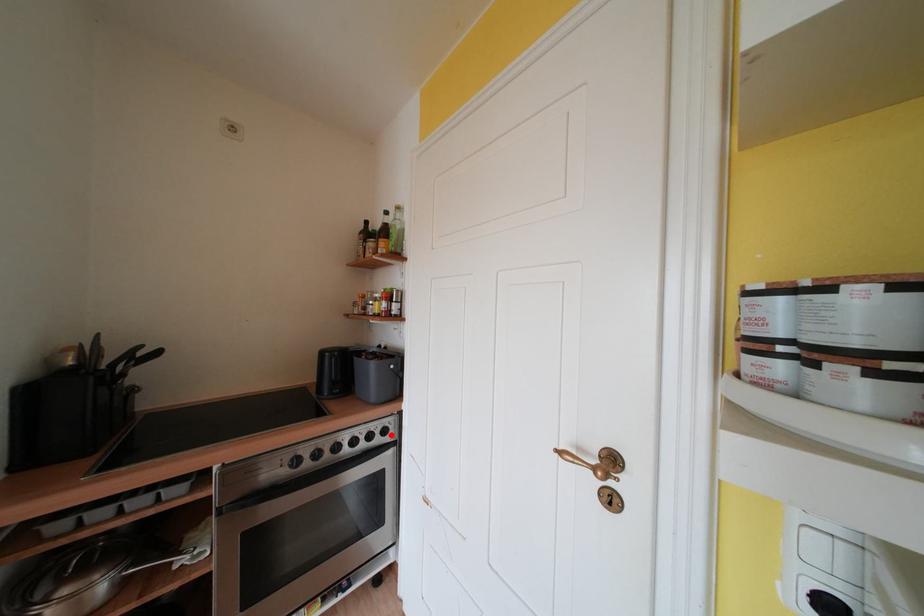
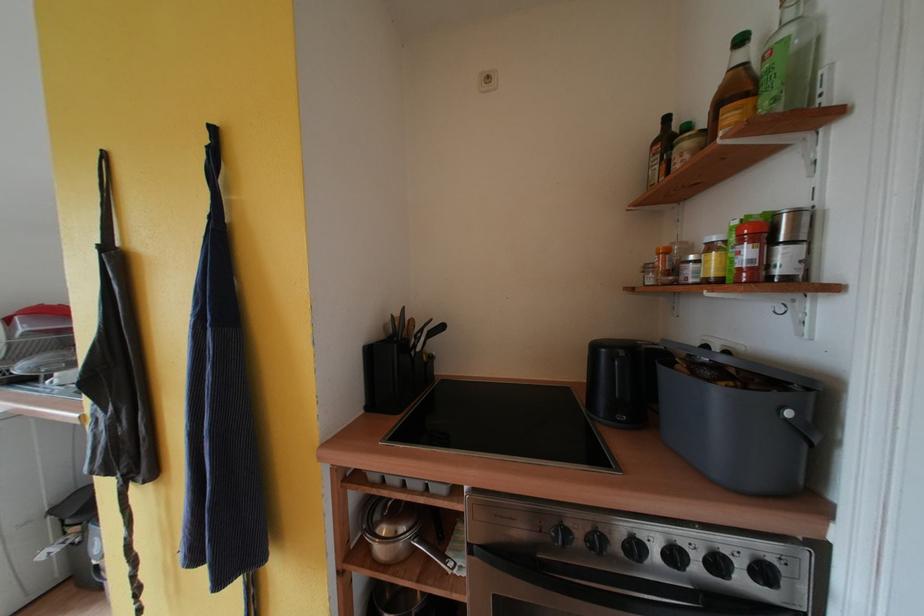
Question: I am providing you with two images of the same scene from different viewpoints. Given a red point in image1, look at the same physical point in image2. Is it:

Choices:
 (A) Closer to the viewpoint
 (B) Farther from the viewpoint

Answer: (A)